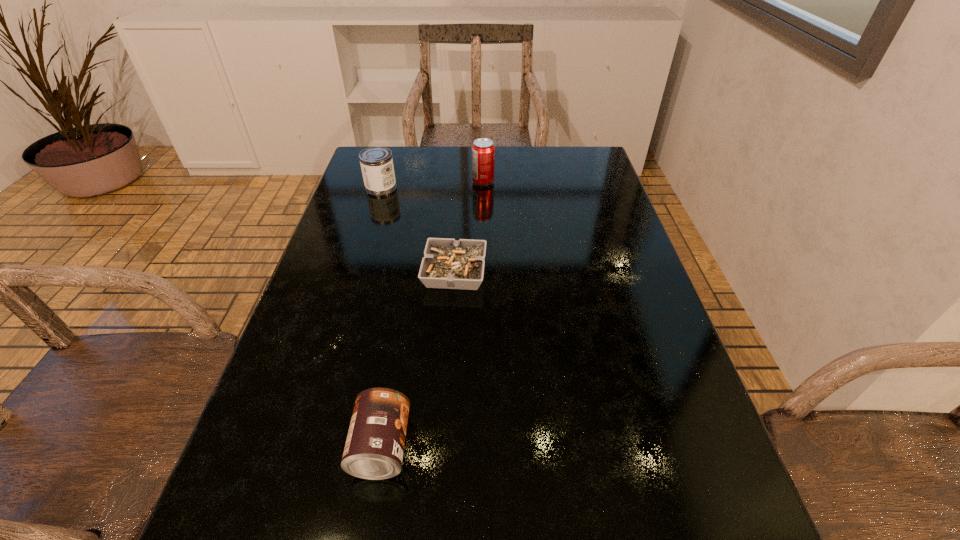
Where is `free area in between the shortest object and the taller can`? This screenshot has height=540, width=960. free area in between the shortest object and the taller can is located at coordinates (418, 230).

Image resolution: width=960 pixels, height=540 pixels. I want to click on free space between the tallest object and the ashtray, so click(468, 227).

Find the location of a particular element. Image resolution: width=960 pixels, height=540 pixels. blank region between the soda and the taller can is located at coordinates (432, 185).

Where is `vacant point located between the tallest object and the nearer can`? The width and height of the screenshot is (960, 540). vacant point located between the tallest object and the nearer can is located at coordinates (432, 314).

The width and height of the screenshot is (960, 540). Identify the location of free space that is in between the third farthest object and the nearest object. (418, 359).

You are a GUI agent. You are given a task and a screenshot of the screen. Output one action in this format:
    pyautogui.click(x=<x>, y=<y>)
    Task: Click on the free space between the farther can and the soda
    The image size is (960, 540).
    Given the screenshot: What is the action you would take?
    pyautogui.click(x=432, y=185)

Locate an element on the screen. free space between the leftmost object and the shorter can is located at coordinates (381, 317).

The image size is (960, 540). I want to click on free spot between the third shortest object and the shorter can, so click(381, 317).

Identify the location of vacant point located between the farther can and the nearer can. (381, 317).

The height and width of the screenshot is (540, 960). I want to click on vacant space that is in between the taller can and the second nearest object, so click(x=418, y=230).